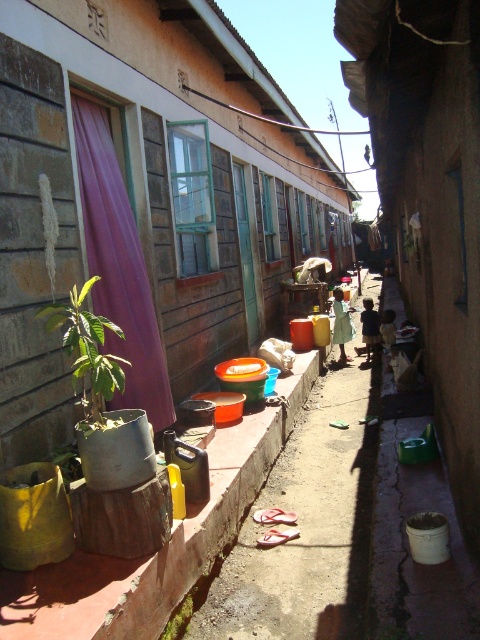
Can you confirm if green matte plant at left is positioned to the right of green leafy plant at lower center?

In fact, green matte plant at left is to the left of green leafy plant at lower center.

Is green matte plant at left above green leafy plant at lower center?

Yes.

At what (x,y) coordinates should I click in order to perform the action: click on green matte plant at left. Please return your answer as a coordinate pair (x, y). This screenshot has width=480, height=640. Looking at the image, I should click on (88, 356).

Who is more forward, (104, 300) or (176, 627)?

Point (176, 627) is in front.

Does purple fabric curtain at left have a smaller size compared to green leafy plant at lower center?

No.

Does point (99, 134) lie in front of point (178, 634)?

No, it is not.

You are a GUI agent. You are given a task and a screenshot of the screen. Output one action in this format:
    pyautogui.click(x=<x>, y=<y>)
    Task: Click on the purple fabric curtain at left
    This screenshot has height=640, width=480.
    Given the screenshot: What is the action you would take?
    pyautogui.click(x=119, y=268)

Can you confirm if purple fabric curtain at left is positioned below green matte plant at left?

No, purple fabric curtain at left is not below green matte plant at left.

Who is shorter, purple fabric curtain at left or green matte plant at left?

green matte plant at left

You are a GUI agent. You are given a task and a screenshot of the screen. Output one action in this format:
    pyautogui.click(x=<x>, y=<y>)
    Task: Click on the purple fabric curtain at left
    This screenshot has height=640, width=480.
    Given the screenshot: What is the action you would take?
    pyautogui.click(x=119, y=268)